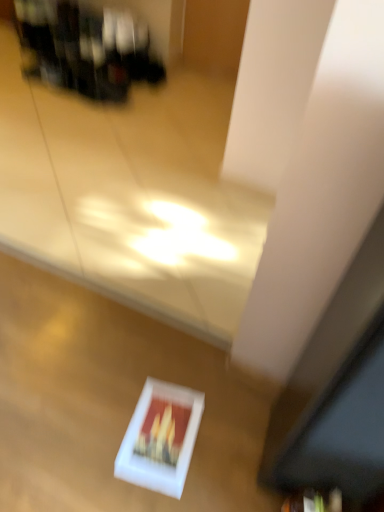
Where is `white matte picture frame at lower center`? The height and width of the screenshot is (512, 384). white matte picture frame at lower center is located at coordinates (160, 438).

This screenshot has width=384, height=512. What do you see at coordinates (160, 438) in the screenshot?
I see `white matte picture frame at lower center` at bounding box center [160, 438].

What is the approximate width of white matte picture frame at lower center?

32.53 centimeters.

At what (x,y) coordinates should I click in order to perform the action: click on white matte picture frame at lower center. Please return your answer as a coordinate pair (x, y). The image size is (384, 512). Looking at the image, I should click on (160, 438).